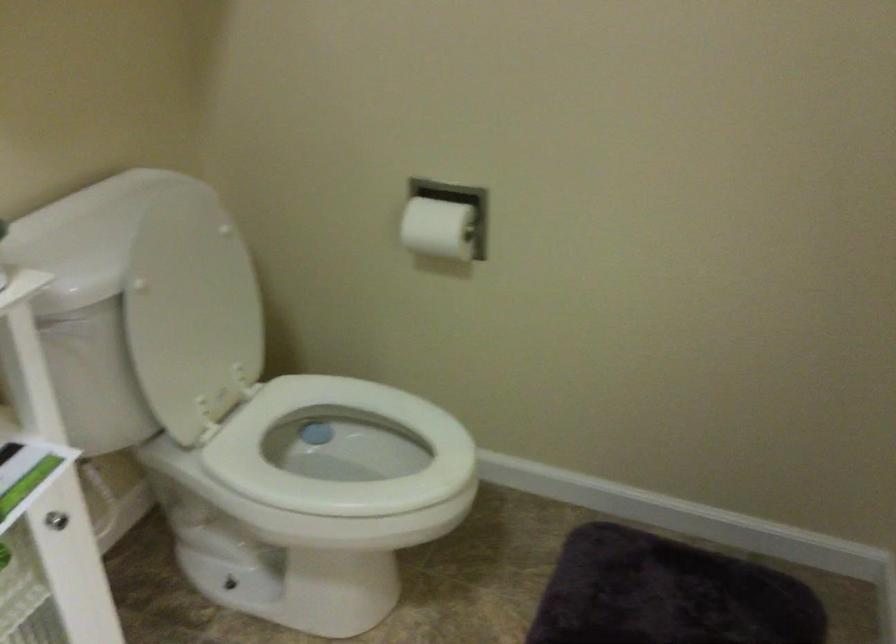
Describe the element at coordinates (192, 315) in the screenshot. I see `the white toilet lid` at that location.